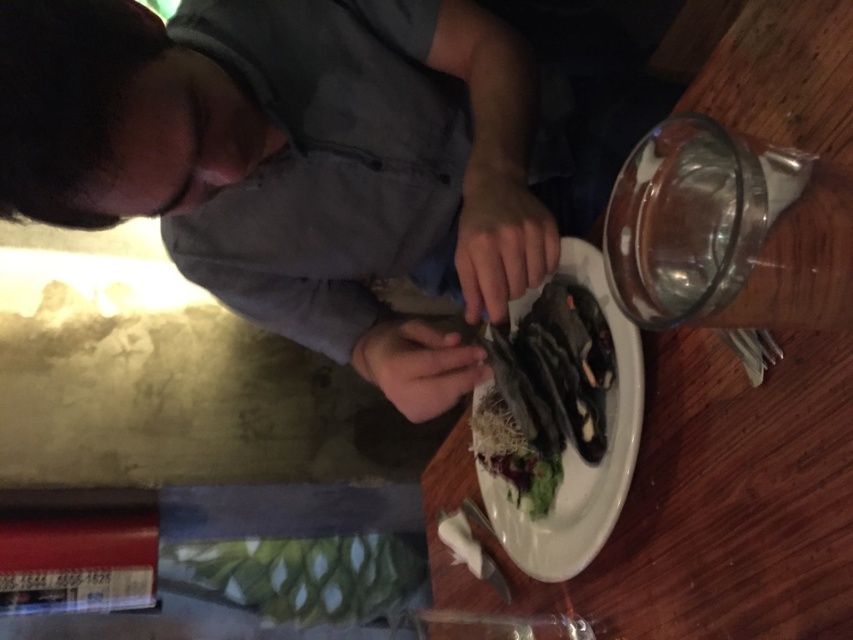
You are a photographer trying to capture the perfect shot of the scene. To ensure the gray matte shirt at center is in focus, where should you aim your camera? Specify the coordinates provided in the description.

The gray matte shirt at center is located at coordinates point (274, 164) according to the description, so you should aim your camera at that point to ensure it is in focus.

You are a waiter in a restaurant and need to deliver a dessert to the customer sitting at the wooden table at center. The customer is wearing a gray matte shirt at center. Where should you place the dessert relative to the customer?

The wooden table at center is behind gray matte shirt at center, so you should place the dessert on the wooden table at center behind the customer.

You are a delivery robot standing at the entrance of the dining area. The point you need to reach is point (463, 378). Can you reach it without moving past the table?

The distance of point (463, 378) from viewer is 25.77 inches. Since the robot needs to reach the point without moving past the table, it depends on the table dimensions. However, the provided information only states the distance from the viewer, not the table dimensions. Therefore, it cannot be determined with certainty.